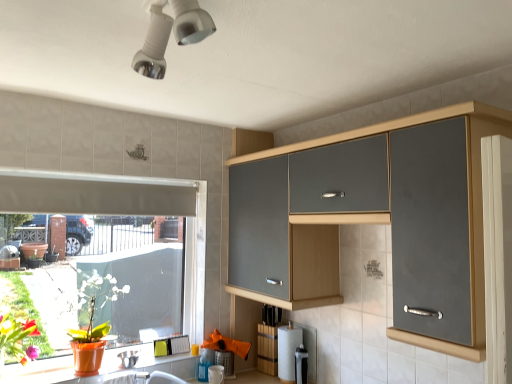
Question: From the image's perspective, is white matte window at lower left on top of white matte exhaust hood at left?

Choices:
 (A) no
 (B) yes

Answer: (A)

Question: Is white matte window at lower left taller than white matte exhaust hood at left?

Choices:
 (A) no
 (B) yes

Answer: (B)

Question: Considering the relative sizes of white matte window at lower left and white matte exhaust hood at left in the image provided, is white matte window at lower left thinner than white matte exhaust hood at left?

Choices:
 (A) no
 (B) yes

Answer: (A)

Question: Can you confirm if white matte window at lower left is positioned to the right of white matte exhaust hood at left?

Choices:
 (A) yes
 (B) no

Answer: (B)

Question: Is white matte window at lower left looking in the opposite direction of white matte exhaust hood at left?

Choices:
 (A) no
 (B) yes

Answer: (B)

Question: Is white matte window at lower left behind white matte exhaust hood at left?

Choices:
 (A) yes
 (B) no

Answer: (A)

Question: Is satin black coffee maker at lower center, placed as the 2th appliance when sorted from left to right, directly adjacent to satin silver bowl at lower left, the first appliance viewed from the left?

Choices:
 (A) no
 (B) yes

Answer: (A)

Question: Would you say satin black coffee maker at lower center, the first appliance positioned from the right, is outside satin silver bowl at lower left, which is counted as the 2th appliance, starting from the right?

Choices:
 (A) yes
 (B) no

Answer: (A)

Question: Considering the relative sizes of satin black coffee maker at lower center, the first appliance positioned from the right, and satin silver bowl at lower left, the first appliance viewed from the left, in the image provided, is satin black coffee maker at lower center, the first appliance positioned from the right, taller than satin silver bowl at lower left, the first appliance viewed from the left,?

Choices:
 (A) no
 (B) yes

Answer: (B)

Question: Is satin black coffee maker at lower center, the first appliance positioned from the right, to the left of satin silver bowl at lower left, which is counted as the 2th appliance, starting from the right, from the viewer's perspective?

Choices:
 (A) yes
 (B) no

Answer: (B)

Question: Considering the relative sizes of satin black coffee maker at lower center, the first appliance positioned from the right, and satin silver bowl at lower left, which is counted as the 2th appliance, starting from the right, in the image provided, is satin black coffee maker at lower center, the first appliance positioned from the right, smaller than satin silver bowl at lower left, which is counted as the 2th appliance, starting from the right,?

Choices:
 (A) yes
 (B) no

Answer: (A)

Question: From a real-world perspective, is satin black coffee maker at lower center, placed as the 2th appliance when sorted from left to right, on satin silver bowl at lower left, the first appliance viewed from the left?

Choices:
 (A) yes
 (B) no

Answer: (B)

Question: From a real-world perspective, is matte gray cabinet at upper right on white matte window at lower left?

Choices:
 (A) yes
 (B) no

Answer: (A)